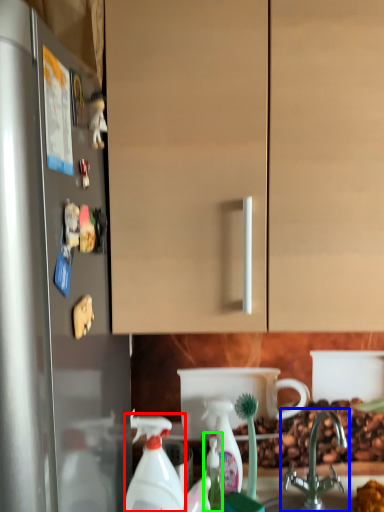
Question: Based on their relative distances, which object is farther from cleaning product (highlighted by a red box)? Choose from tap (highlighted by a blue box) and bottle (highlighted by a green box).

Choices:
 (A) tap
 (B) bottle

Answer: (A)